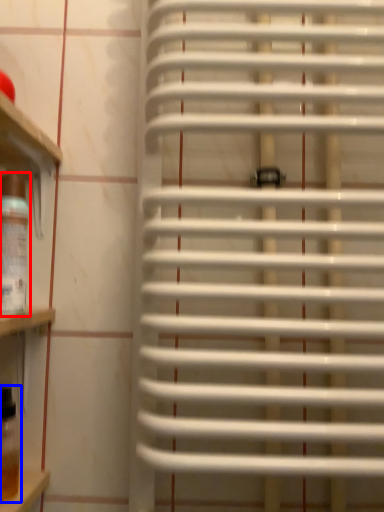
Question: Which object appears farthest to the camera in this image, wine bottle (highlighted by a red box) or wine bottle (highlighted by a blue box)?

Choices:
 (A) wine bottle
 (B) wine bottle

Answer: (B)